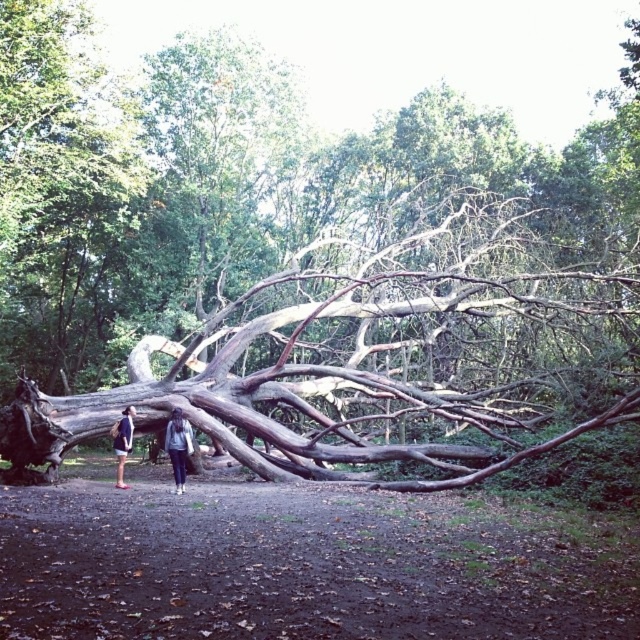
You are standing in a forest and see two points marked on the ground near a large fallen tree. The points are labeled as point 1 at coordinates [113,618] and point 2 at coordinates [184,472]. Which point is closer to you?

Point 1 at coordinates [113,618] is closer to the viewer than point 2 at coordinates [184,472].

You are hiking in the forest and see the denim jacket at center and denim shorts at lower left. Which one is positioned more to the right side?

The denim jacket at center is positioned to the right of denim shorts at lower left, so the denim jacket at center is more to the right side.